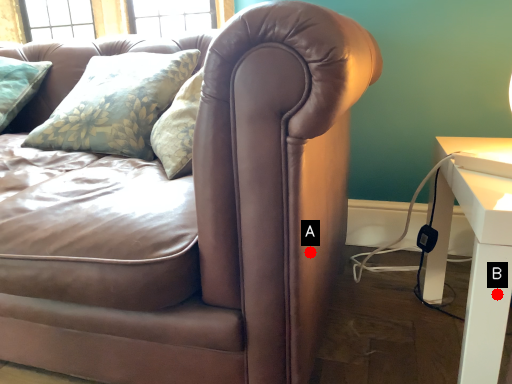
Question: Two points are circled on the image, labeled by A and B beside each circle. Which point is further to the camera?

Choices:
 (A) A is further
 (B) B is further

Answer: (A)